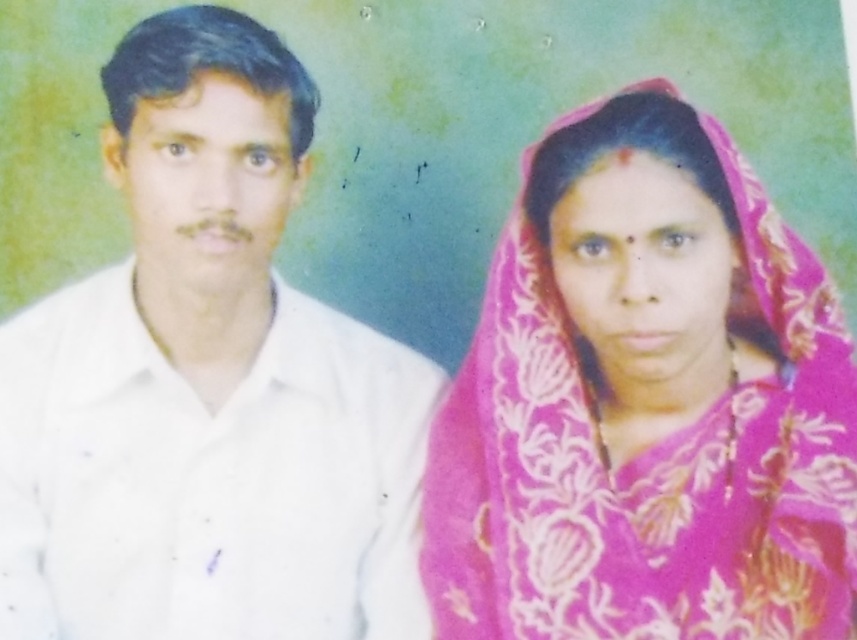
Looking at this image, you are a photographer adjusting the focus on your camera. You have two points to focus on in the image, point 1 at coordinates point (x=118, y=188) and point 2 at coordinates point (x=830, y=625). Which point is closer to you?

Point (x=118, y=188) is closer to the photographer because it is further to the viewer than point (x=830, y=625).

You are a photographer standing 1.5 meters away from the camera. You want to adjust the focus on the white cotton shirt at left. Can you reach it without moving your position?

The white cotton shirt at left is 1.03 meters from viewer. Since you are standing 1.5 meters away from the camera, you are farther than the distance to the shirt. Therefore, you cannot reach the white cotton shirt at left without moving closer.

You are standing in front of the image and want to know the position of the white cotton shirt at left relative to the woman in the pink saree. Can you determine if it is to the left or right of her?

The white cotton shirt at left is located at point (207, 385). Since the woman is on the right side of the frame, the shirt is to the left of her.